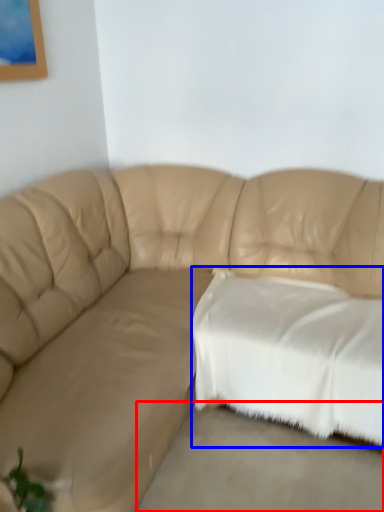
Question: Among these objects, which one is nearest to the camera, concrete (highlighted by a red box) or pillow (highlighted by a blue box)?

Choices:
 (A) concrete
 (B) pillow

Answer: (A)